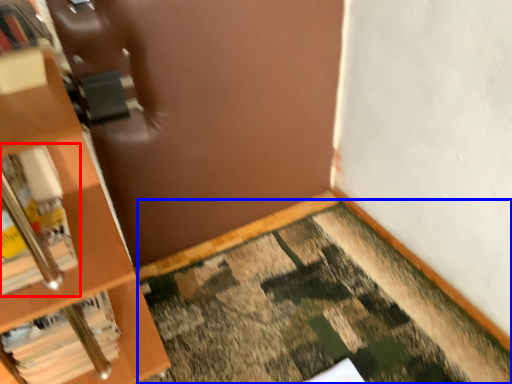
Question: Which of the following is the closest to the observer, book (highlighted by a red box) or doormat (highlighted by a blue box)?

Choices:
 (A) book
 (B) doormat

Answer: (B)